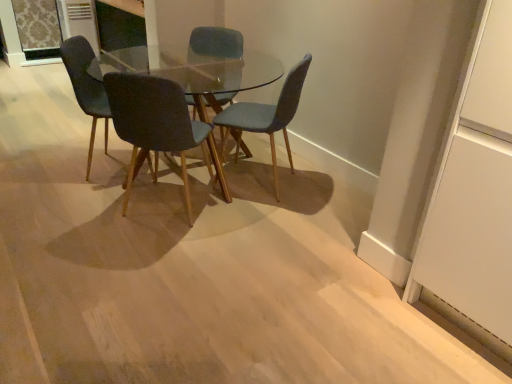
What do you see at coordinates (475, 190) in the screenshot? This screenshot has width=512, height=384. I see `transparent glass door at upper right` at bounding box center [475, 190].

This screenshot has width=512, height=384. What do you see at coordinates (266, 116) in the screenshot? I see `textured blue chair at center, arranged as the 1th chair when viewed from the right` at bounding box center [266, 116].

The image size is (512, 384). In order to click on transparent glass table at center in this screenshot , I will do `click(194, 70)`.

Is dark gray fabric chair at center, which appears as the third chair when viewed from the right, bigger than transparent glass door at upper right?

No.

Which of these two, dark gray fabric chair at center, which appears as the third chair when viewed from the right, or transparent glass door at upper right, stands shorter?

Standing shorter between the two is dark gray fabric chair at center, which appears as the third chair when viewed from the right.

Which is closer, (196, 130) or (489, 33)?

Point (196, 130) appears to be farther away from the viewer than point (489, 33).

Consider the image. Is dark gray fabric chair at center, the 2th chair positioned from the left, facing towards matte blue chair at center, placed as the third chair when sorted from left to right?

Yes, dark gray fabric chair at center, the 2th chair positioned from the left, is aimed at matte blue chair at center, placed as the third chair when sorted from left to right.

Where is `the 3rd chair below the matte blue chair at center, placed as the third chair when sorted from left to right (from the image's perspective)`? the 3rd chair below the matte blue chair at center, placed as the third chair when sorted from left to right (from the image's perspective) is located at coordinates (157, 125).

Which object is wider, dark gray fabric chair at center, which appears as the third chair when viewed from the right, or matte blue chair at center, the 2th chair positioned from the right?

dark gray fabric chair at center, which appears as the third chair when viewed from the right, is wider.

Does point (220, 46) come closer to viewer compared to point (490, 162)?

No, (220, 46) is further to viewer.

From the image's perspective, does matte blue chair at center, placed as the third chair when sorted from left to right, appear higher than transparent glass door at upper right?

Yes, from the image's perspective, matte blue chair at center, placed as the third chair when sorted from left to right, is on top of transparent glass door at upper right.

Considering the relative positions of matte blue chair at center, placed as the third chair when sorted from left to right, and transparent glass door at upper right in the image provided, is matte blue chair at center, placed as the third chair when sorted from left to right, in front of transparent glass door at upper right?

That is False.

Based on their positions, is matte blue chair at center, placed as the third chair when sorted from left to right, located to the left or right of transparent glass door at upper right?

From the image, it's evident that matte blue chair at center, placed as the third chair when sorted from left to right, is to the left of transparent glass door at upper right.

From a real-world perspective, which is physically above, matte blue chair at center, which is the first chair in left-to-right order, or dark gray fabric chair at center, the 2th chair positioned from the left?

From a 3D spatial view, matte blue chair at center, which is the first chair in left-to-right order, is above.

From the image's perspective, count 2nd chairs upward from the dark gray fabric chair at center, the 2th chair positioned from the left, and point to it. Please provide its 2D coordinates.

[(87, 89)]

Which is correct: matte blue chair at center, which is the first chair in left-to-right order, is inside dark gray fabric chair at center, which appears as the third chair when viewed from the right, or outside of it?

matte blue chair at center, which is the first chair in left-to-right order, is outside dark gray fabric chair at center, which appears as the third chair when viewed from the right.

From a real-world perspective, is transparent glass door at upper right physically above transparent glass table at center?

Yes, from a real-world perspective, transparent glass door at upper right is on top of transparent glass table at center.

Is transparent glass door at upper right positioned with its back to transparent glass table at center?

No, transparent glass table at center is not at the back of transparent glass door at upper right.

Considering the sizes of transparent glass door at upper right and transparent glass table at center in the image, is transparent glass door at upper right taller or shorter than transparent glass table at center?

Clearly, transparent glass door at upper right is taller compared to transparent glass table at center.

From the image's perspective, which object appears higher, matte blue chair at center, positioned as the fourth chair in right-to-left order, or transparent glass door at upper right?

matte blue chair at center, positioned as the fourth chair in right-to-left order.

Based on the photo, is transparent glass door at upper right at the back of matte blue chair at center, positioned as the fourth chair in right-to-left order?

No, matte blue chair at center, positioned as the fourth chair in right-to-left order, is not facing away from transparent glass door at upper right.

Which of these two, matte blue chair at center, which is the first chair in left-to-right order, or transparent glass door at upper right, is bigger?

transparent glass door at upper right.

Looking at this image, is textured blue chair at center, acting as the fourth chair starting from the left, facing away from matte blue chair at center, the 2th chair positioned from the right?

That's not correct — textured blue chair at center, acting as the fourth chair starting from the left, is not looking away from matte blue chair at center, the 2th chair positioned from the right.

Is textured blue chair at center, acting as the fourth chair starting from the left, touching matte blue chair at center, the 2th chair positioned from the right?

textured blue chair at center, acting as the fourth chair starting from the left, is not next to matte blue chair at center, the 2th chair positioned from the right, and they're not touching.

From the picture: Is textured blue chair at center, arranged as the 1th chair when viewed from the right, positioned before matte blue chair at center, placed as the third chair when sorted from left to right?

Yes.

At what (x,y) coordinates should I click in order to perform the action: click on glass door that appears on the right of dark gray fabric chair at center, the 2th chair positioned from the left. Please return your answer as a coordinate pair (x, y). The width and height of the screenshot is (512, 384). Looking at the image, I should click on (475, 190).

This screenshot has height=384, width=512. Find the location of `chair that is the 3rd object located in front of the matte blue chair at center, placed as the third chair when sorted from left to right`. chair that is the 3rd object located in front of the matte blue chair at center, placed as the third chair when sorted from left to right is located at coordinates (157, 125).

Which object lies further to the anchor point matte blue chair at center, placed as the third chair when sorted from left to right, textured blue chair at center, acting as the fourth chair starting from the left, or matte blue chair at center, which is the first chair in left-to-right order?

matte blue chair at center, which is the first chair in left-to-right order, is positioned further to the anchor matte blue chair at center, placed as the third chair when sorted from left to right.

Looking at the image, which one is located closer to transparent glass door at upper right, transparent glass table at center or matte blue chair at center, which is the first chair in left-to-right order?

The object closer to transparent glass door at upper right is matte blue chair at center, which is the first chair in left-to-right order.

Looking at the image, which one is located closer to textured blue chair at center, acting as the fourth chair starting from the left, transparent glass door at upper right or transparent glass table at center?

transparent glass door at upper right lies closer to textured blue chair at center, acting as the fourth chair starting from the left, than the other object.

From the image, which object appears to be nearer to matte blue chair at center, the 2th chair positioned from the right, dark gray fabric chair at center, the 2th chair positioned from the left, or matte blue chair at center, positioned as the fourth chair in right-to-left order?

Based on the image, matte blue chair at center, positioned as the fourth chair in right-to-left order, appears to be nearer to matte blue chair at center, the 2th chair positioned from the right.

In the scene shown: Based on their spatial positions, is matte blue chair at center, positioned as the fourth chair in right-to-left order, or transparent glass door at upper right further from dark gray fabric chair at center, the 2th chair positioned from the left?

transparent glass door at upper right is further to dark gray fabric chair at center, the 2th chair positioned from the left.

Based on their spatial positions, is textured blue chair at center, acting as the fourth chair starting from the left, or transparent glass door at upper right further from dark gray fabric chair at center, which appears as the third chair when viewed from the right?

The object further to dark gray fabric chair at center, which appears as the third chair when viewed from the right, is transparent glass door at upper right.

When comparing their distances from matte blue chair at center, positioned as the fourth chair in right-to-left order, does dark gray fabric chair at center, the 2th chair positioned from the left, or transparent glass table at center seem further?

transparent glass table at center is positioned further to the anchor matte blue chair at center, positioned as the fourth chair in right-to-left order.

Looking at the image, which one is located closer to matte blue chair at center, placed as the third chair when sorted from left to right, transparent glass table at center or dark gray fabric chair at center, the 2th chair positioned from the left?

dark gray fabric chair at center, the 2th chair positioned from the left, is positioned closer to the anchor matte blue chair at center, placed as the third chair when sorted from left to right.

Image resolution: width=512 pixels, height=384 pixels. Find the location of `coffee table between transparent glass door at upper right and matte blue chair at center, the 2th chair positioned from the right, in the front-back direction`. coffee table between transparent glass door at upper right and matte blue chair at center, the 2th chair positioned from the right, in the front-back direction is located at coordinates (194, 70).

What are the coordinates of `coffee table located between matte blue chair at center, positioned as the fourth chair in right-to-left order, and transparent glass door at upper right in the left-right direction` in the screenshot? It's located at (194, 70).

Where is `coffee table between dark gray fabric chair at center, which appears as the third chair when viewed from the right, and transparent glass door at upper right`? The width and height of the screenshot is (512, 384). coffee table between dark gray fabric chair at center, which appears as the third chair when viewed from the right, and transparent glass door at upper right is located at coordinates (194, 70).

This screenshot has height=384, width=512. I want to click on coffee table between dark gray fabric chair at center, which appears as the third chair when viewed from the right, and matte blue chair at center, placed as the third chair when sorted from left to right, along the z-axis, so (194, 70).